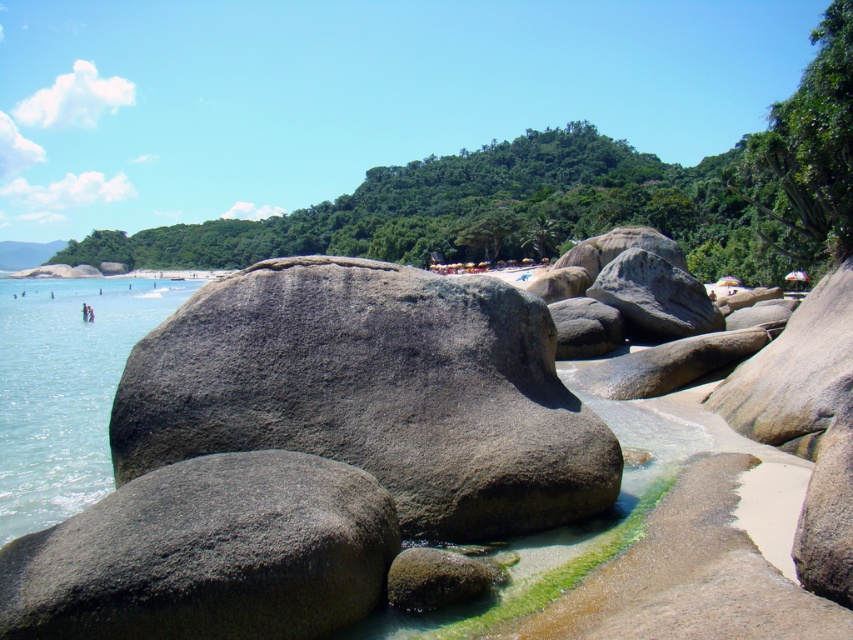
Question: Estimate the real-world distances between objects in this image. Which object is closer to the gray textured rock at lower left?

Choices:
 (A) clear water at left
 (B) gray rough boulder at center

Answer: (B)

Question: Can you confirm if gray textured rock at lower left is thinner than clear water at left?

Choices:
 (A) yes
 (B) no

Answer: (A)

Question: Which object appears closest to the camera in this image?

Choices:
 (A) gray rough boulder at center
 (B) gray textured rock at lower left
 (C) clear water at left

Answer: (B)

Question: Is gray rough boulder at center wider than gray textured rock at lower left?

Choices:
 (A) no
 (B) yes

Answer: (B)

Question: Which object is positioned farthest from the gray textured rock at lower left?

Choices:
 (A) clear water at left
 (B) gray rough boulder at center

Answer: (A)

Question: Is gray textured rock at lower left wider than clear water at left?

Choices:
 (A) yes
 (B) no

Answer: (B)